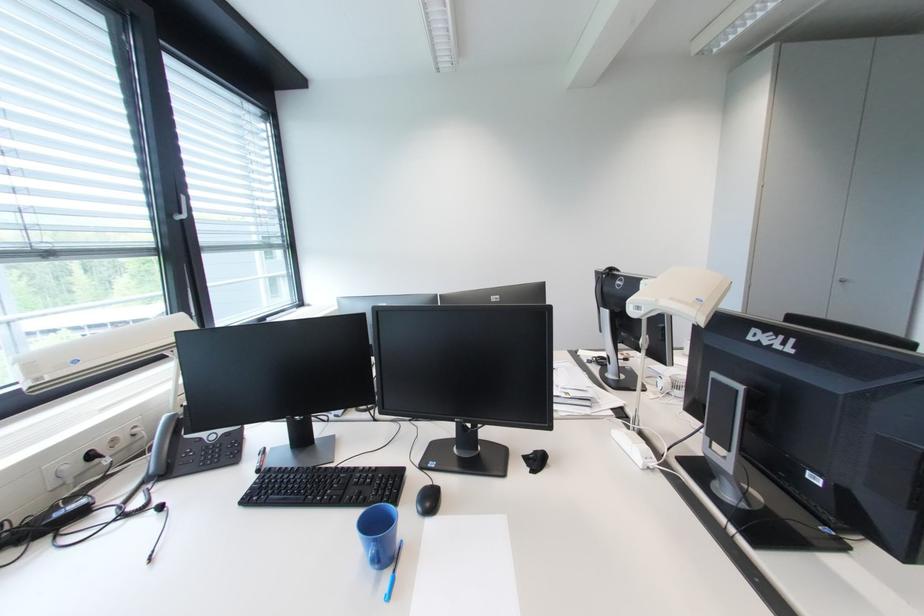
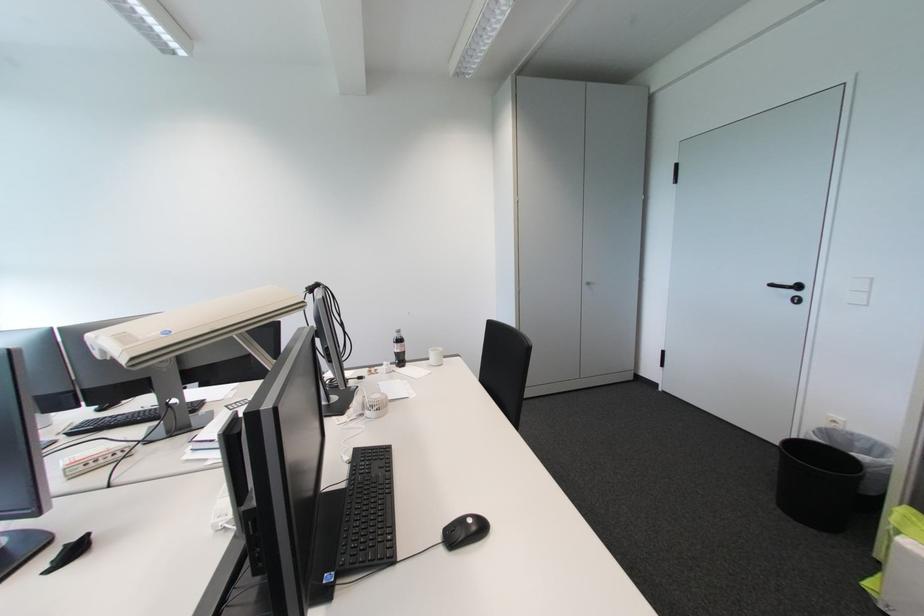
Question: The first image is from the beginning of the video and the second image is from the end. How did the camera likely rotate when shooting the video?

Choices:
 (A) Left
 (B) Right
 (C) Up
 (D) Down

Answer: (B)